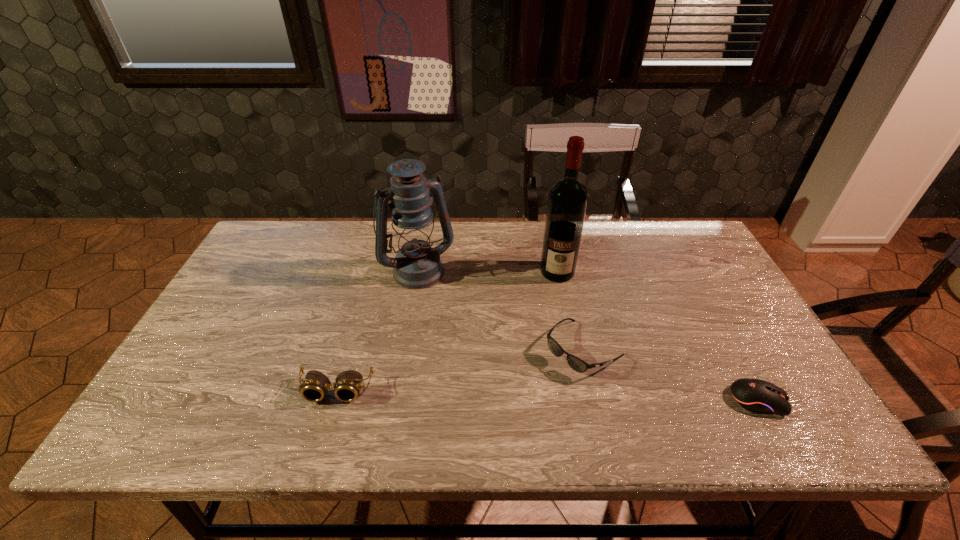
This screenshot has height=540, width=960. I want to click on blank space that satisfies the following two spatial constraints: 1. through the lenses of the goggles; 2. on the left side of the computer mouse, so click(333, 400).

Locate an element on the screen. The width and height of the screenshot is (960, 540). vacant space that satisfies the following two spatial constraints: 1. through the lenses of the goggles; 2. on the left side of the shortest object is located at coordinates (333, 400).

Locate an element on the screen. The width and height of the screenshot is (960, 540). vacant space that satisfies the following two spatial constraints: 1. through the lenses of the goggles; 2. on the left side of the shortest object is located at coordinates (333, 400).

Identify the location of vacant space that satisfies the following two spatial constraints: 1. on the front side of the rightmost object; 2. on the right side of the lantern. (396, 400).